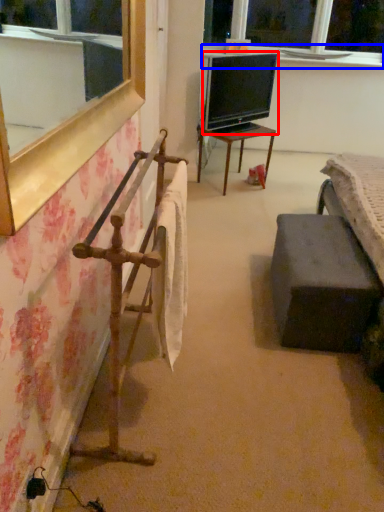
Question: Which point is further to the camera, television (highlighted by a red box) or window sill (highlighted by a blue box)?

Choices:
 (A) television
 (B) window sill

Answer: (B)